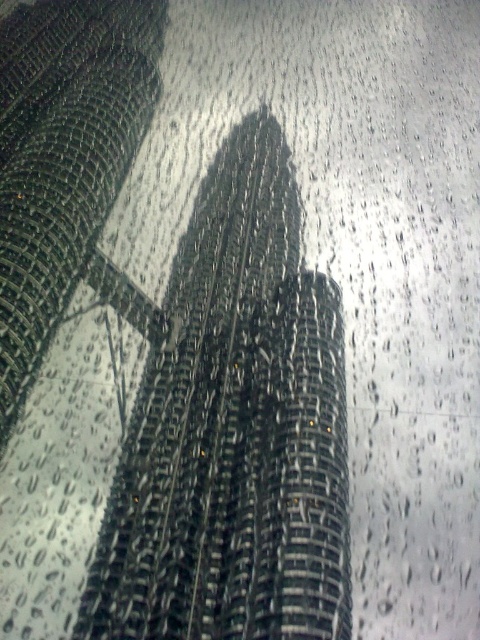
Which of these two, reflective glass tower at center or metallic grid tower at center, stands taller?

metallic grid tower at center is taller.

Is point (216, 600) farther from camera compared to point (41, 202)?

No, it is not.

Identify the location of reflective glass tower at center. The height and width of the screenshot is (640, 480). (233, 432).